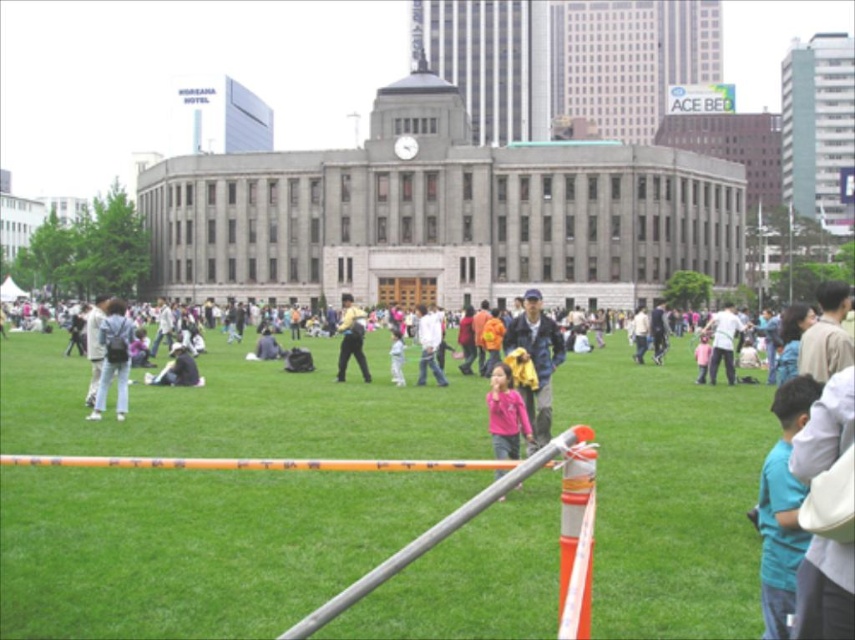
You are a photographer at the park and want to take a photo of the orange plastic rail at center and the matte black backpack at left. Which object should you focus on first if you want to capture both in the frame without moving the camera?

The orange plastic rail at center is positioned on the right side of the matte black backpack at left, so you should focus on the matte black backpack at left first to ensure both objects are within the frame.